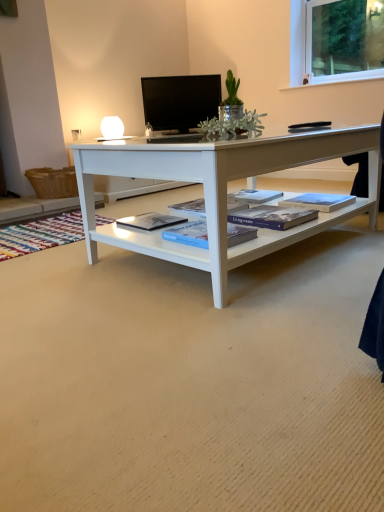
This screenshot has height=512, width=384. Identify the location of free space above blue matte book at center, the 2th book when ordered from right to left (from a real-world perspective). (265, 211).